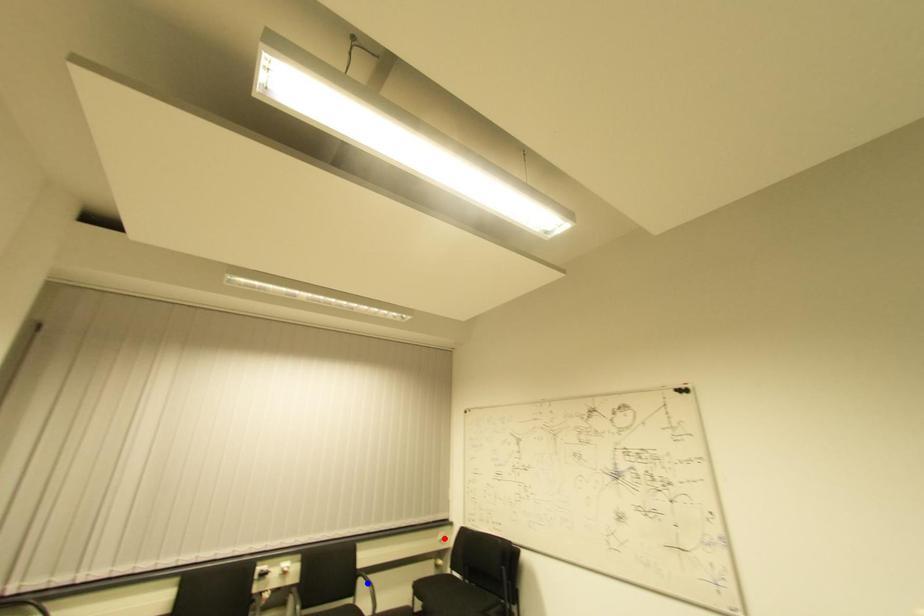
Question: Which of the two points in the image is closer to the camera?

Choices:
 (A) Blue point is closer.
 (B) Red point is closer.

Answer: (A)